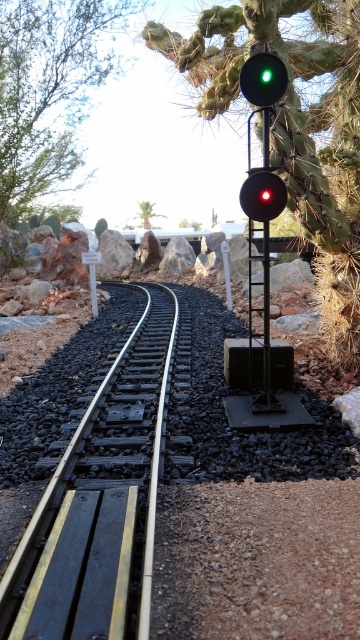
You are a model train engineer observing the miniature railway setup. Your train is currently on the black metal train track at left and needs to pass the matte black traffic light at upper center. Can you safely navigate your train forward without hitting the traffic light?

The black metal train track at left is in front of the matte black traffic light at upper center, meaning the track is closer to you than the traffic light. Since the track leads directly toward the traffic light, you can safely navigate your train forward as long as you follow the track and maintain control, ensuring you don

You are a model train engineer operating a train on the black metal train track at left. You notice the green glass traffic light at upper center. Since the track is higher than the light, could your train derail if it goes under the light?

The black metal train track at left is taller than the green glass traffic light at upper center, so the train would not hit the light and should not derail when passing under it.